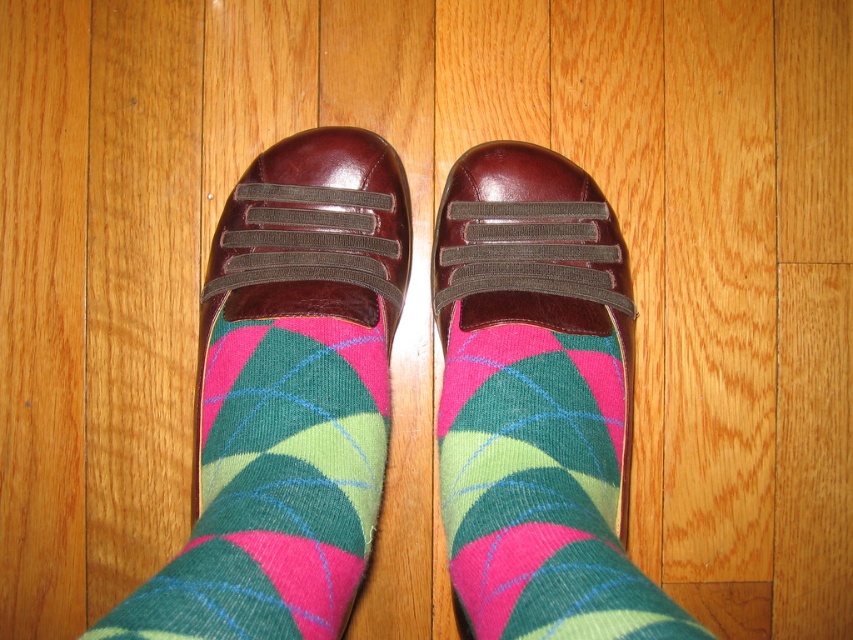
Question: In this image, where is green argyle sock at center located relative to multicolored knitted sock at center?

Choices:
 (A) above
 (B) below

Answer: (B)

Question: Does green argyle sock at center come behind multicolored knitted sock at center?

Choices:
 (A) yes
 (B) no

Answer: (B)

Question: Is the position of green argyle sock at center less distant than that of multicolored knitted sock at center?

Choices:
 (A) no
 (B) yes

Answer: (B)

Question: Among these objects, which one is nearest to the camera?

Choices:
 (A) green argyle sock at center
 (B) multicolored knitted sock at center

Answer: (A)

Question: Which point is farther from the camera taking this photo?

Choices:
 (A) (381, 397)
 (B) (703, 632)

Answer: (A)